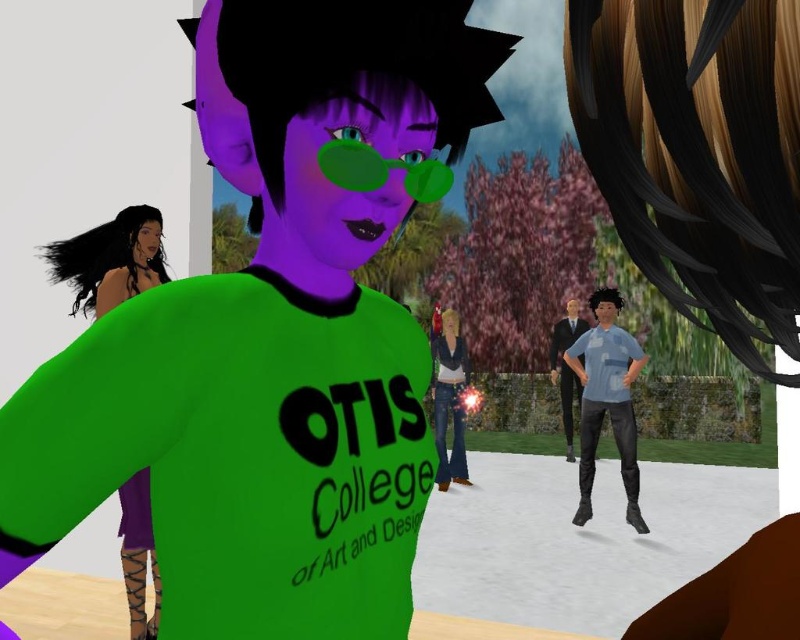
You are an artist looking to sketch the character in the image. You notice the light blue fabric shirt at center and the denim jeans at center. Which of these two items is positioned higher on the character?

The light blue fabric shirt at center is much taller as denim jeans at center, so the light blue fabric shirt at center is positioned higher on the character.

You are a fashion designer observing a runway show. You notice the purple matte dress at left and the denim jeans at center. Which clothing item is shorter in height?

The purple matte dress at left has a lesser height compared to denim jeans at center, so the purple matte dress at left is shorter in height.